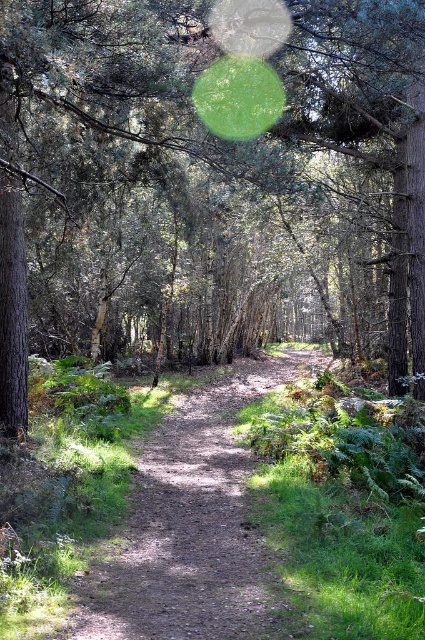
Is green leafy tree at center to the right of dirt path at center from the viewer's perspective?

Incorrect, green leafy tree at center is not on the right side of dirt path at center.

Does green leafy tree at center have a greater height compared to dirt path at center?

Correct, green leafy tree at center is much taller as dirt path at center.

Is point (150, 208) closer to camera compared to point (146, 477)?

No, (150, 208) is further to viewer.

What are the coordinates of `green leafy tree at center` in the screenshot? It's located at (210, 176).